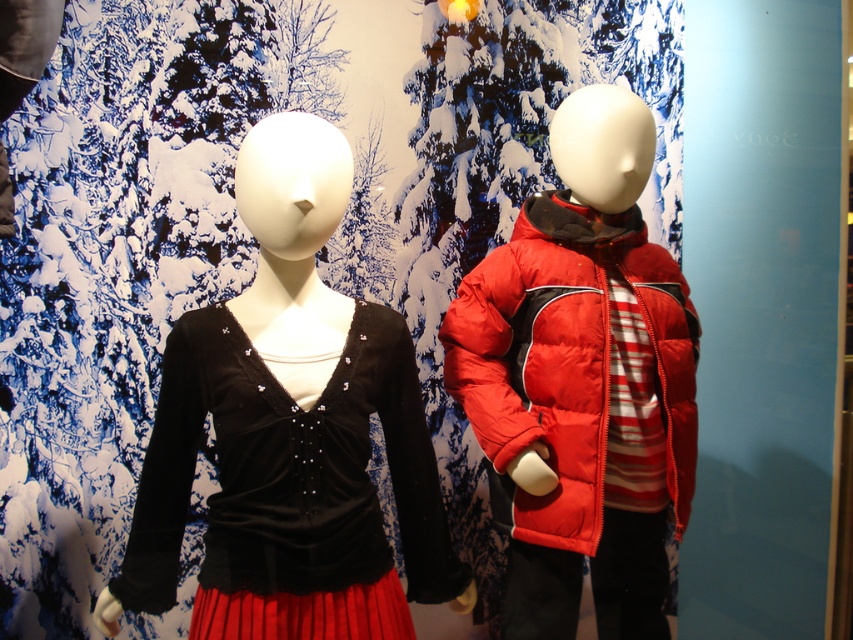
Question: Which point is farther to the camera?

Choices:
 (A) matte red puffer jacket at right
 (B) velvet black top at center

Answer: (A)

Question: Among these objects, which one is nearest to the camera?

Choices:
 (A) matte red puffer jacket at right
 (B) velvet black top at center

Answer: (B)

Question: Does velvet black top at center lie in front of matte red puffer jacket at right?

Choices:
 (A) no
 (B) yes

Answer: (B)

Question: Can you confirm if velvet black top at center is thinner than matte red puffer jacket at right?

Choices:
 (A) yes
 (B) no

Answer: (B)

Question: Observing the image, what is the correct spatial positioning of velvet black top at center in reference to matte red puffer jacket at right?

Choices:
 (A) below
 (B) above

Answer: (A)